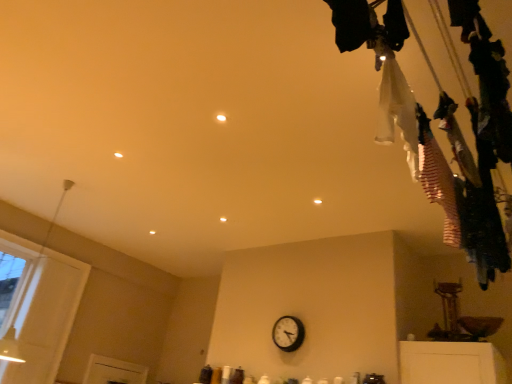
Locate an element on the screen. This screenshot has width=512, height=384. white striped fabric at upper right, positioned as the 1th clothing in right-to-left order is located at coordinates (437, 179).

The width and height of the screenshot is (512, 384). What do you see at coordinates (437, 179) in the screenshot? I see `white striped fabric at upper right, positioned as the 1th clothing in right-to-left order` at bounding box center [437, 179].

You are a GUI agent. You are given a task and a screenshot of the screen. Output one action in this format:
    pyautogui.click(x=<x>, y=<y>)
    Task: Click on the black plastic wall clock at center
    The image size is (512, 384).
    Given the screenshot: What is the action you would take?
    pyautogui.click(x=288, y=333)

From their relative heights in the image, would you say white fabric at upper right, placed as the 1th clothing when sorted from left to right, is taller or shorter than black plastic wall clock at center?

In the image, white fabric at upper right, placed as the 1th clothing when sorted from left to right, appears to be taller than black plastic wall clock at center.

Is white fabric at upper right, placed as the 1th clothing when sorted from left to right, further to the viewer compared to black plastic wall clock at center?

No, white fabric at upper right, placed as the 1th clothing when sorted from left to right, is in front of black plastic wall clock at center.

Considering the relative sizes of white fabric at upper right, placed as the 1th clothing when sorted from left to right, and black plastic wall clock at center in the image provided, is white fabric at upper right, placed as the 1th clothing when sorted from left to right, thinner than black plastic wall clock at center?

In fact, white fabric at upper right, placed as the 1th clothing when sorted from left to right, might be wider than black plastic wall clock at center.

Does white striped fabric at upper right, the second clothing from the left, turn towards white fabric at upper right, placed as the 1th clothing when sorted from left to right?

No, white striped fabric at upper right, the second clothing from the left, is not turned towards white fabric at upper right, placed as the 1th clothing when sorted from left to right.

Are white striped fabric at upper right, the second clothing from the left, and white fabric at upper right, placed as the 1th clothing when sorted from left to right, making contact?

white striped fabric at upper right, the second clothing from the left, and white fabric at upper right, placed as the 1th clothing when sorted from left to right, are clearly separated.

Is white striped fabric at upper right, positioned as the 1th clothing in right-to-left order, not within white fabric at upper right, the second clothing in the right-to-left sequence?

Indeed, white striped fabric at upper right, positioned as the 1th clothing in right-to-left order, is completely outside white fabric at upper right, the second clothing in the right-to-left sequence.

Does white striped fabric at upper right, the second clothing from the left, have a smaller size compared to black plastic wall clock at center?

Actually, white striped fabric at upper right, the second clothing from the left, might be larger than black plastic wall clock at center.

Which object is positioned more to the left, white striped fabric at upper right, the second clothing from the left, or black plastic wall clock at center?

black plastic wall clock at center is more to the left.

Is white striped fabric at upper right, positioned as the 1th clothing in right-to-left order, taller than black plastic wall clock at center?

Correct, white striped fabric at upper right, positioned as the 1th clothing in right-to-left order, is much taller as black plastic wall clock at center.

From a real-world perspective, is white fabric at upper right, the second clothing in the right-to-left sequence, physically located above or below white striped fabric at upper right, the second clothing from the left?

From a real-world perspective, white fabric at upper right, the second clothing in the right-to-left sequence, is physically above white striped fabric at upper right, the second clothing from the left.

In the image, is white fabric at upper right, placed as the 1th clothing when sorted from left to right, on the left side or the right side of white striped fabric at upper right, positioned as the 1th clothing in right-to-left order?

Based on their positions, white fabric at upper right, placed as the 1th clothing when sorted from left to right, is located to the left of white striped fabric at upper right, positioned as the 1th clothing in right-to-left order.

Can you confirm if white fabric at upper right, the second clothing in the right-to-left sequence, is shorter than white striped fabric at upper right, positioned as the 1th clothing in right-to-left order?

Incorrect, the height of white fabric at upper right, the second clothing in the right-to-left sequence, does not fall short of that of white striped fabric at upper right, positioned as the 1th clothing in right-to-left order.

Is white fabric at upper right, the second clothing in the right-to-left sequence, bigger or smaller than white striped fabric at upper right, positioned as the 1th clothing in right-to-left order?

Considering their sizes, white fabric at upper right, the second clothing in the right-to-left sequence, takes up less space than white striped fabric at upper right, positioned as the 1th clothing in right-to-left order.

Between point (277, 326) and point (441, 202), which one is positioned in front?

The point (441, 202) is closer.

From a real-world perspective, between black plastic wall clock at center and white striped fabric at upper right, positioned as the 1th clothing in right-to-left order, who is vertically lower?

black plastic wall clock at center.

Consider the image. From the image's perspective, would you say black plastic wall clock at center is shown under white striped fabric at upper right, positioned as the 1th clothing in right-to-left order?

Yes, from the image's perspective, black plastic wall clock at center is below white striped fabric at upper right, positioned as the 1th clothing in right-to-left order.

Considering the sizes of black plastic wall clock at center and white fabric at upper right, placed as the 1th clothing when sorted from left to right, in the image, is black plastic wall clock at center taller or shorter than white fabric at upper right, placed as the 1th clothing when sorted from left to right,?

black plastic wall clock at center is shorter than white fabric at upper right, placed as the 1th clothing when sorted from left to right.

From a real-world perspective, who is located higher, black plastic wall clock at center or white fabric at upper right, placed as the 1th clothing when sorted from left to right?

white fabric at upper right, placed as the 1th clothing when sorted from left to right, from a real-world perspective.

Is the depth of black plastic wall clock at center greater than that of white fabric at upper right, placed as the 1th clothing when sorted from left to right?

That is True.

From the image's perspective, count 2nd clothings upward from the black plastic wall clock at center and point to it. Please provide its 2D coordinates.

[(397, 110)]

Where is `clothing behind the white fabric at upper right, the second clothing in the right-to-left sequence`? clothing behind the white fabric at upper right, the second clothing in the right-to-left sequence is located at coordinates (437, 179).

Which object lies nearer to the anchor point white fabric at upper right, placed as the 1th clothing when sorted from left to right, black plastic wall clock at center or white striped fabric at upper right, the second clothing from the left?

white striped fabric at upper right, the second clothing from the left.

Considering their positions, is white fabric at upper right, the second clothing in the right-to-left sequence, positioned closer to black plastic wall clock at center than white striped fabric at upper right, positioned as the 1th clothing in right-to-left order?

Among the two, white striped fabric at upper right, positioned as the 1th clothing in right-to-left order, is located nearer to black plastic wall clock at center.

Based on their spatial positions, is black plastic wall clock at center or white fabric at upper right, the second clothing in the right-to-left sequence, closer to white striped fabric at upper right, the second clothing from the left?

white fabric at upper right, the second clothing in the right-to-left sequence, is positioned closer to the anchor white striped fabric at upper right, the second clothing from the left.

Estimate the real-world distances between objects in this image. Which object is further from white striped fabric at upper right, positioned as the 1th clothing in right-to-left order, white fabric at upper right, placed as the 1th clothing when sorted from left to right, or black plastic wall clock at center?

black plastic wall clock at center lies further to white striped fabric at upper right, positioned as the 1th clothing in right-to-left order, than the other object.

Based on their spatial positions, is white striped fabric at upper right, the second clothing from the left, or black plastic wall clock at center closer to white fabric at upper right, the second clothing in the right-to-left sequence?

white striped fabric at upper right, the second clothing from the left, lies closer to white fabric at upper right, the second clothing in the right-to-left sequence, than the other object.

Considering their positions, is white striped fabric at upper right, positioned as the 1th clothing in right-to-left order, positioned closer to black plastic wall clock at center than white fabric at upper right, placed as the 1th clothing when sorted from left to right?

The object closer to black plastic wall clock at center is white striped fabric at upper right, positioned as the 1th clothing in right-to-left order.

Identify the location of clothing between white fabric at upper right, the second clothing in the right-to-left sequence, and black plastic wall clock at center from front to back. Image resolution: width=512 pixels, height=384 pixels. (437, 179).